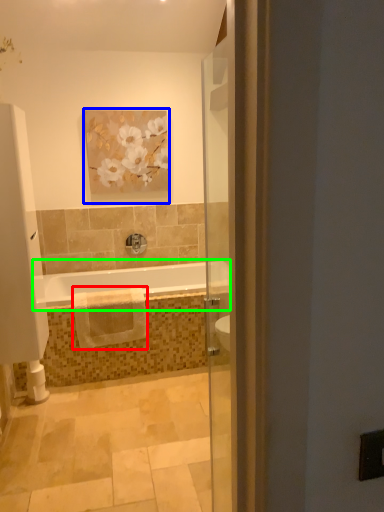
Question: Considering the real-world distances, which object is farthest from material (highlighted by a red box)? picture frame (highlighted by a blue box) or bathtub (highlighted by a green box)?

Choices:
 (A) picture frame
 (B) bathtub

Answer: (A)